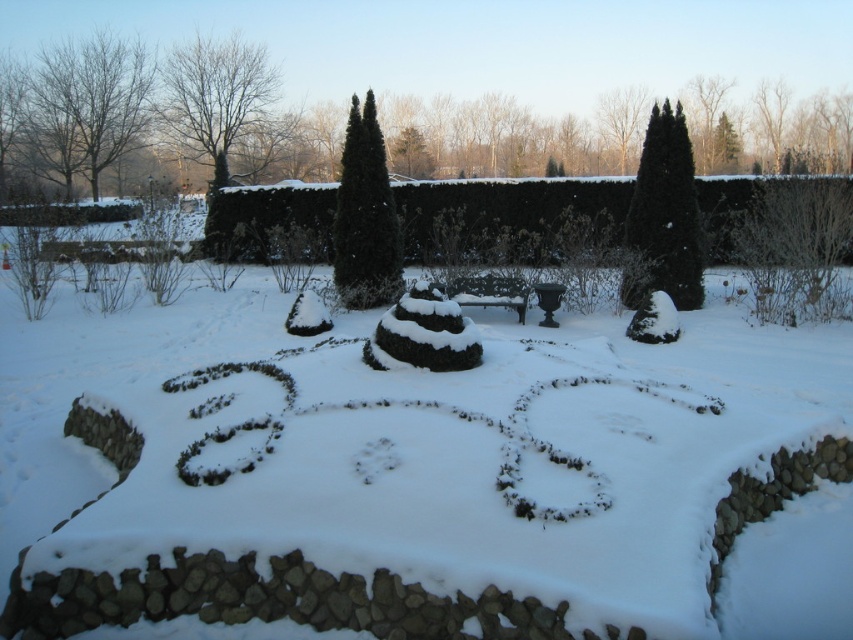
Identify the location of green leafy hedge at center. The width and height of the screenshot is (853, 640). (505, 216).

Is point (262, 243) in front of point (248, 83)?

Yes, point (262, 243) is in front of point (248, 83).

This screenshot has height=640, width=853. I want to click on green leafy hedge at center, so click(505, 216).

You are a GUI agent. You are given a task and a screenshot of the screen. Output one action in this format:
    pyautogui.click(x=<x>, y=<y>)
    Task: Click on the green leafy hedge at center
    
    Given the screenshot: What is the action you would take?
    point(505,216)

Where is `green leafy hedge at center`? This screenshot has width=853, height=640. green leafy hedge at center is located at coordinates click(505, 216).

Is green leafy hedge at center above brown leafless tree at upper left?

No.

Where is `green leafy hedge at center`? The width and height of the screenshot is (853, 640). green leafy hedge at center is located at coordinates (505, 216).

I want to click on green leafy hedge at center, so click(505, 216).

Does point (22, 131) come in front of point (241, 99)?

That is True.

Identify the location of brown leafless tree at upper left. The height and width of the screenshot is (640, 853). pos(85,108).